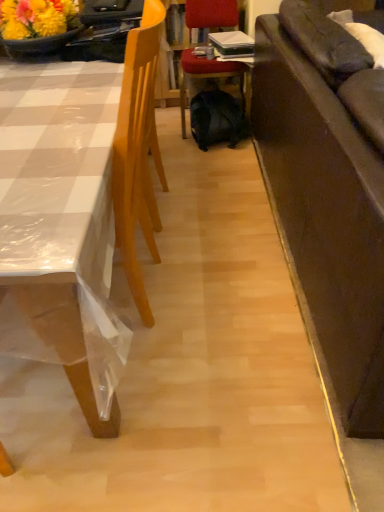
The height and width of the screenshot is (512, 384). Describe the element at coordinates (217, 119) in the screenshot. I see `black matte backpack at center` at that location.

Measure the distance between dark brown leather couch at right and camera.

The distance of dark brown leather couch at right from camera is 34.78 inches.

Describe the element at coordinates (326, 217) in the screenshot. Image resolution: width=384 pixels, height=512 pixels. I see `dark brown leather couch at right` at that location.

What are the coordinates of `light wood chair at left, the 2th chair when ordered from right to left` in the screenshot? It's located at (61, 228).

Where is `chair above the light wood chair at left, the 2th chair when ordered from right to left (from a real-world perspective)`? The image size is (384, 512). chair above the light wood chair at left, the 2th chair when ordered from right to left (from a real-world perspective) is located at coordinates (207, 76).

From the image's perspective, which is above, velvet red chair at center, placed as the second chair when sorted from left to right, or light wood chair at left, placed as the first chair when sorted from left to right?

From the image's view, velvet red chair at center, placed as the second chair when sorted from left to right, is above.

Is the depth of dark brown leather couch at right greater than that of light wood chair at left, placed as the first chair when sorted from left to right?

No, the depth of dark brown leather couch at right is less than that of light wood chair at left, placed as the first chair when sorted from left to right.

Consider the image. Looking at the image, does dark brown leather couch at right seem bigger or smaller compared to light wood chair at left, placed as the first chair when sorted from left to right?

Clearly, dark brown leather couch at right is smaller in size than light wood chair at left, placed as the first chair when sorted from left to right.

Considering the points (292, 201) and (97, 149), which point is behind, point (292, 201) or point (97, 149)?

Point (292, 201)

Is dark brown leather couch at right not close to light wood chair at left, the 2th chair when ordered from right to left?

No, dark brown leather couch at right is not far away from light wood chair at left, the 2th chair when ordered from right to left.

Could you tell me if light wood chair at left, placed as the first chair when sorted from left to right, is facing dark brown leather couch at right?

No, light wood chair at left, placed as the first chair when sorted from left to right, is not facing towards dark brown leather couch at right.

Find the location of a particular element. This screenshot has width=384, height=512. studio couch above the light wood chair at left, placed as the first chair when sorted from left to right (from the image's perspective) is located at coordinates (326, 217).

Is light wood chair at left, placed as the first chair when sorted from left to right, taller than dark brown leather couch at right?

No, light wood chair at left, placed as the first chair when sorted from left to right, is not taller than dark brown leather couch at right.

Does point (71, 381) come behind point (383, 338)?

That is True.

Considering the sizes of black matte backpack at center and dark brown leather couch at right in the image, is black matte backpack at center wider or thinner than dark brown leather couch at right?

Considering their sizes, black matte backpack at center looks slimmer than dark brown leather couch at right.

I want to click on studio couch located on the right of black matte backpack at center, so (x=326, y=217).

From the image's perspective, is black matte backpack at center above or below dark brown leather couch at right?

black matte backpack at center is situated higher than dark brown leather couch at right in the image.

From the image's perspective, between velvet red chair at center, placed as the second chair when sorted from left to right, and black matte backpack at center, who is located below?

From the image's view, black matte backpack at center is below.

Is velvet red chair at center, placed as the second chair when sorted from left to right, positioned far away from black matte backpack at center?

velvet red chair at center, placed as the second chair when sorted from left to right, is near black matte backpack at center, not far away.

Between point (182, 76) and point (208, 116), which one is positioned in front?

Positioned in front is point (208, 116).

Who is shorter, velvet red chair at center, placed as the second chair when sorted from left to right, or black matte backpack at center?

black matte backpack at center.

Looking at this image, can we say dark brown leather couch at right lies outside black matte backpack at center?

dark brown leather couch at right is positioned outside black matte backpack at center.

In the image, is dark brown leather couch at right positioned in front of or behind black matte backpack at center?

In the image, dark brown leather couch at right appears in front of black matte backpack at center.

From a real-world perspective, is dark brown leather couch at right positioned above or below black matte backpack at center?

Clearly, from a real-world perspective, dark brown leather couch at right is above black matte backpack at center.

Between dark brown leather couch at right and velvet red chair at center, placed as the second chair when sorted from left to right, which one has less height?

Standing shorter between the two is velvet red chair at center, placed as the second chair when sorted from left to right.

Between dark brown leather couch at right and velvet red chair at center, placed as the second chair when sorted from left to right, which one has larger size?

dark brown leather couch at right is bigger.

Which point is more forward, (292, 145) or (190, 66)?

The point (292, 145) is closer to the camera.

Considering the relative positions of dark brown leather couch at right and velvet red chair at center, placed as the second chair when sorted from left to right, in the image provided, is dark brown leather couch at right to the left or to the right of velvet red chair at center, placed as the second chair when sorted from left to right,?

Clearly, dark brown leather couch at right is on the right of velvet red chair at center, placed as the second chair when sorted from left to right, in the image.

There is a light wood chair at left, the 2th chair when ordered from right to left. Identify the location of chair above it (from a real-world perspective). The image size is (384, 512). (207, 76).

Locate an element on the screen. The width and height of the screenshot is (384, 512). studio couch in front of the light wood chair at left, placed as the first chair when sorted from left to right is located at coordinates (326, 217).

Based on their spatial positions, is light wood chair at left, the 2th chair when ordered from right to left, or velvet red chair at center, placed as the second chair when sorted from left to right, further from black matte backpack at center?

Based on the image, light wood chair at left, the 2th chair when ordered from right to left, appears to be further to black matte backpack at center.

When comparing their distances from light wood chair at left, the 2th chair when ordered from right to left, does velvet red chair at center, placed as the second chair when sorted from left to right, or black matte backpack at center seem closer?

Among the two, black matte backpack at center is located nearer to light wood chair at left, the 2th chair when ordered from right to left.

Considering their positions, is dark brown leather couch at right positioned closer to black matte backpack at center than light wood chair at left, the 2th chair when ordered from right to left?

The object closer to black matte backpack at center is dark brown leather couch at right.

Looking at this image, looking at the image, which one is located closer to light wood chair at left, placed as the first chair when sorted from left to right, dark brown leather couch at right or black matte backpack at center?

The object closer to light wood chair at left, placed as the first chair when sorted from left to right, is dark brown leather couch at right.

In the scene shown: When comparing their distances from velvet red chair at center, placed as the second chair when sorted from left to right, does black matte backpack at center or dark brown leather couch at right seem further?

dark brown leather couch at right is further to velvet red chair at center, placed as the second chair when sorted from left to right.

From the image, which object appears to be nearer to dark brown leather couch at right, light wood chair at left, the 2th chair when ordered from right to left, or velvet red chair at center, placed as the second chair when sorted from left to right?

light wood chair at left, the 2th chair when ordered from right to left.

When comparing their distances from velvet red chair at center, placed as the second chair when sorted from left to right, does dark brown leather couch at right or black matte backpack at center seem closer?

Based on the image, black matte backpack at center appears to be nearer to velvet red chair at center, placed as the second chair when sorted from left to right.

Based on their spatial positions, is dark brown leather couch at right or light wood chair at left, placed as the first chair when sorted from left to right, closer to velvet red chair at center, arranged as the 1th chair when viewed from the right?

dark brown leather couch at right.

Locate an element on the screen. chair between light wood chair at left, placed as the first chair when sorted from left to right, and black matte backpack at center, along the z-axis is located at coordinates (207, 76).

The width and height of the screenshot is (384, 512). Identify the location of chair located between dark brown leather couch at right and velvet red chair at center, arranged as the 1th chair when viewed from the right, in the depth direction. (61, 228).